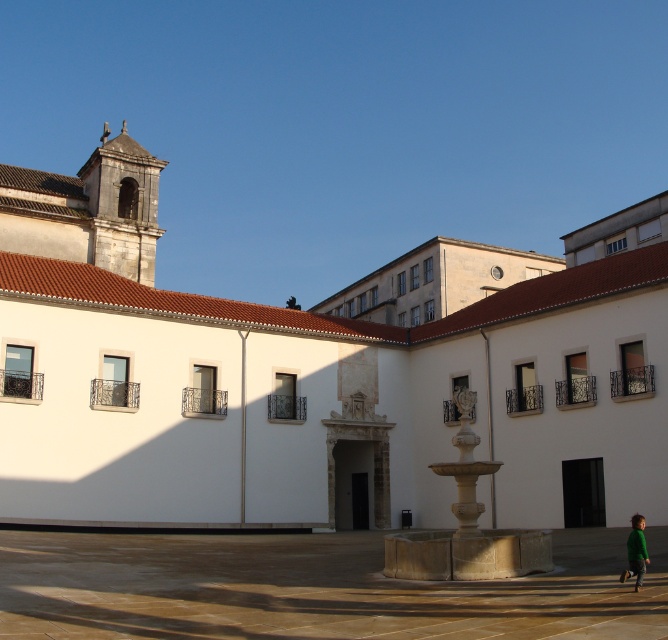
You are standing in the courtyard and want to take a photo of the green matte shirt at lower right without the white stone church at center blocking the view. Is this possible?

The green matte shirt at lower right is behind the white stone church at center, so it would be blocked from view. To capture the shirt without the church obstructing it, you would need to move to a position where the shirt is in front of the church or adjust your angle so the church is not between you and the shirt.

You are standing in the courtyard and want to locate the smooth stone fountain at center. Based on the coordinates provided, which object in the scene corresponds to the point marked at coordinates point (311, 588)?

The point marked at coordinates point (311, 588) corresponds to the smooth stone fountain at center.